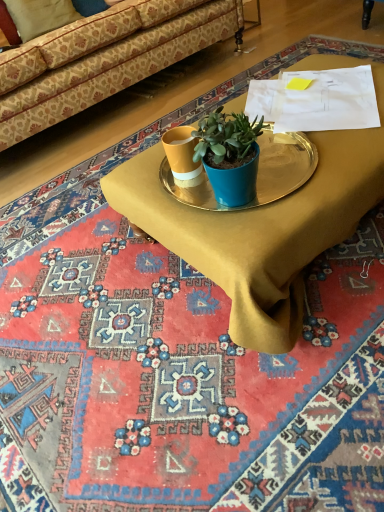
Where is `free spot to the left of metallic gold tray at center`? The width and height of the screenshot is (384, 512). free spot to the left of metallic gold tray at center is located at coordinates (169, 202).